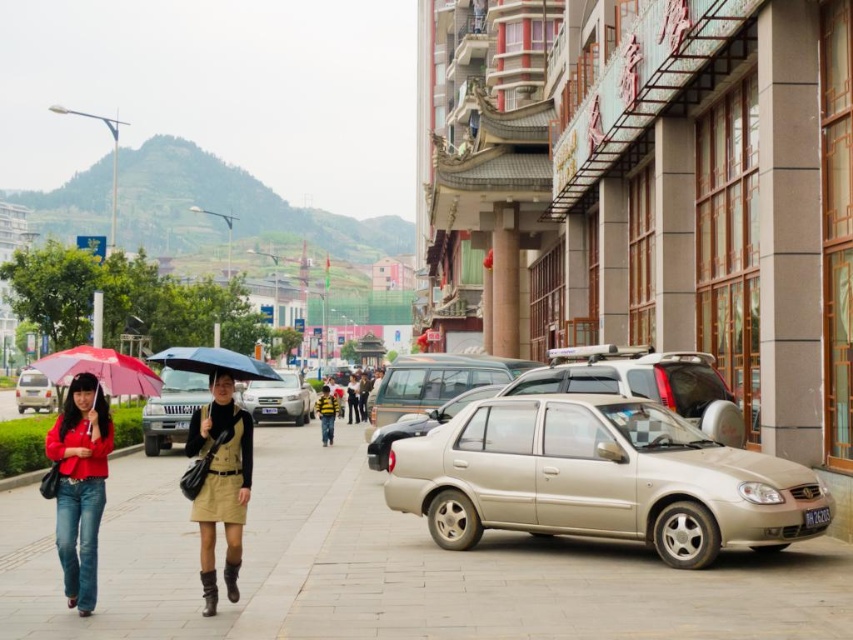
How distant is satin gold car at center from matte silver sedan at left?

The distance of satin gold car at center from matte silver sedan at left is 146.28 feet.

Which is behind, point (462, 392) or point (16, 408)?

Positioned behind is point (16, 408).

Identify the location of satin gold car at center. This screenshot has height=640, width=853. (599, 390).

Which is below, satin gold car at center or matte khaki skirt at center?

satin gold car at center

Can you confirm if satin gold car at center is positioned to the left of matte khaki skirt at center?

In fact, satin gold car at center is to the right of matte khaki skirt at center.

You are a GUI agent. You are given a task and a screenshot of the screen. Output one action in this format:
    pyautogui.click(x=<x>, y=<y>)
    Task: Click on the satin gold car at center
    The height and width of the screenshot is (640, 853).
    Given the screenshot: What is the action you would take?
    pyautogui.click(x=599, y=390)

Is silver metallic sedan at center closer to the viewer compared to matte silver sedan at left?

Yes, it is in front of matte silver sedan at left.

Can you confirm if silver metallic sedan at center is shorter than matte silver sedan at left?

No, silver metallic sedan at center is not shorter than matte silver sedan at left.

What do you see at coordinates (277, 400) in the screenshot?
I see `silver metallic sedan at center` at bounding box center [277, 400].

You are a GUI agent. You are given a task and a screenshot of the screen. Output one action in this format:
    pyautogui.click(x=<x>, y=<y>)
    Task: Click on the silver metallic sedan at center
    
    Given the screenshot: What is the action you would take?
    pyautogui.click(x=277, y=400)